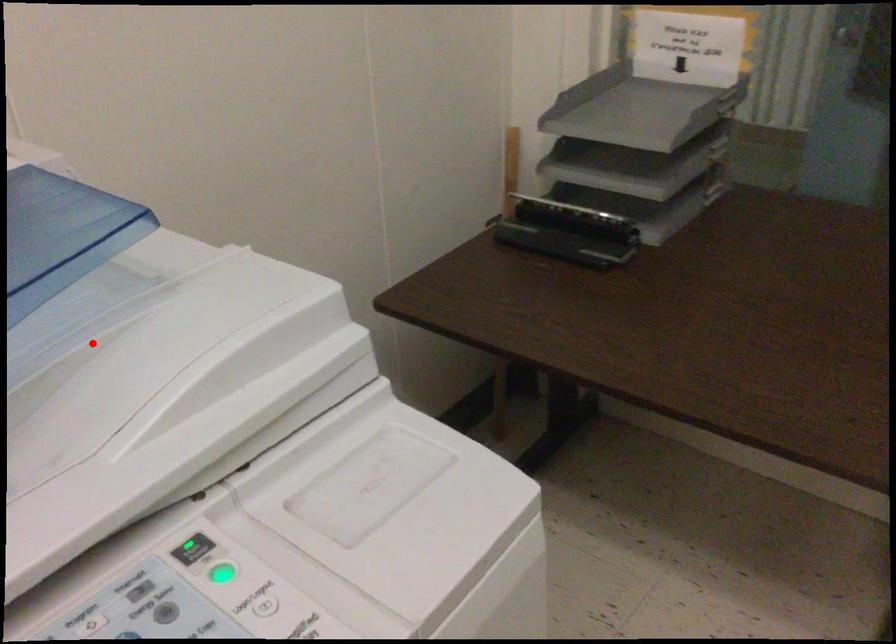
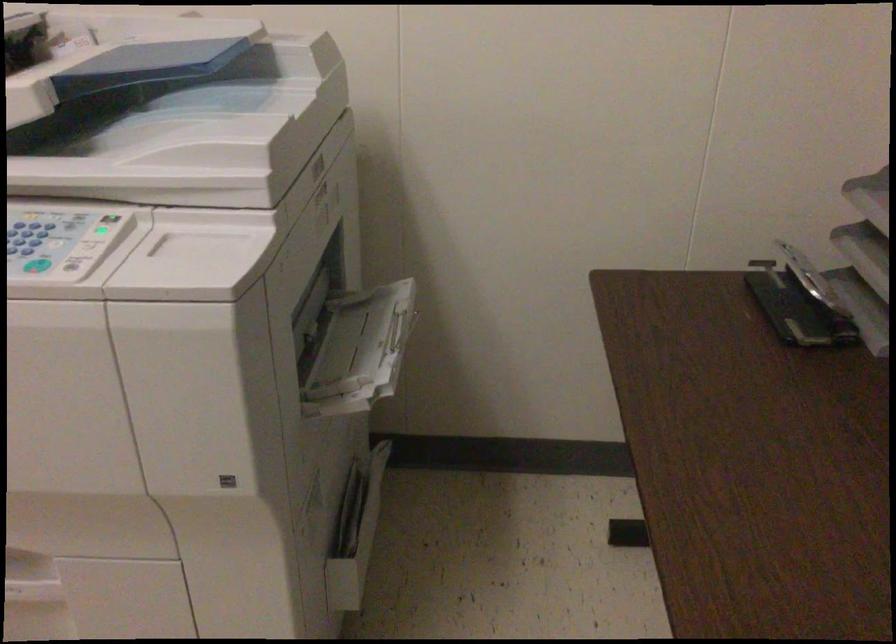
Question: A red point is marked in image1. In image2, is the corresponding 3D point closer to the camera or farther? Reply with the corresponding letter.

Choices:
 (A) The corresponding 3D point is closer.
 (B) The corresponding 3D point is farther.

Answer: (B)